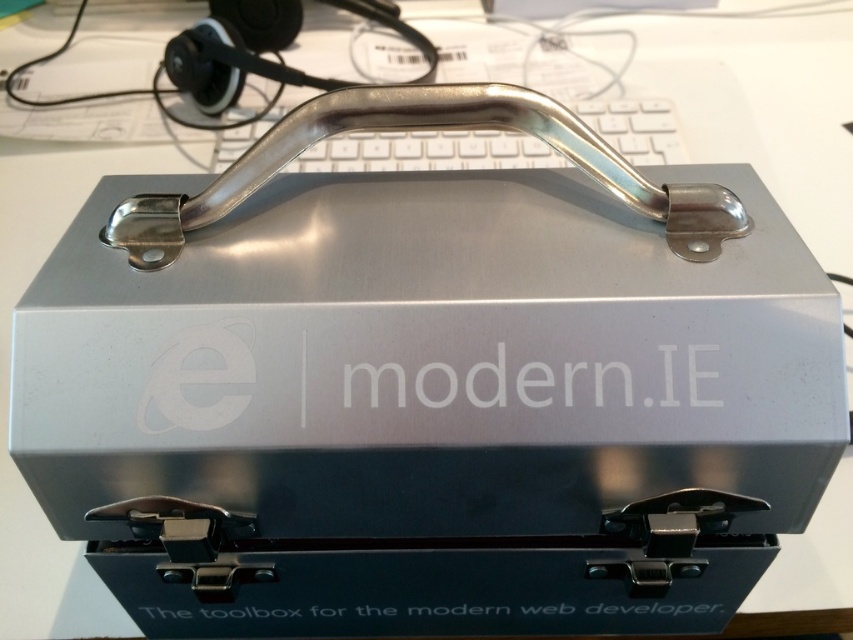
You are organizing a tech conference and need to place the white plastic keyboard at center and the matte black earphone at upper left on a shelf. The shelf has a height limit of 10 cm. Can both items fit vertically on the shelf without exceeding the height limit?

The white plastic keyboard at center is not as tall as the matte black earphone at upper left. Since the shelf has a height limit of 10 cm, both items can fit vertically on the shelf as long as the tallest item, the matte black earphone at upper left, is under 10 cm. However, the exact dimensions are not provided, so we cannot confirm without more information.

You are organizing items on a desk and need to place the white plastic keyboard at center and the matte black earphone at upper left. If you want to move the keyboard closer to the earphone, should you move it forward or backward?

The white plastic keyboard at center is closer to the viewer than the matte black earphone at upper left. To move the keyboard closer to the earphone, you should move it backward towards the earphone.

You are organizing a tech conference and need to place items on a table. You have a white plastic keyboard at center and a matte black earphone at upper left. Which item takes up more space on the table?

The white plastic keyboard at center has a larger size compared to the matte black earphone at upper left, so it takes up more space on the table.